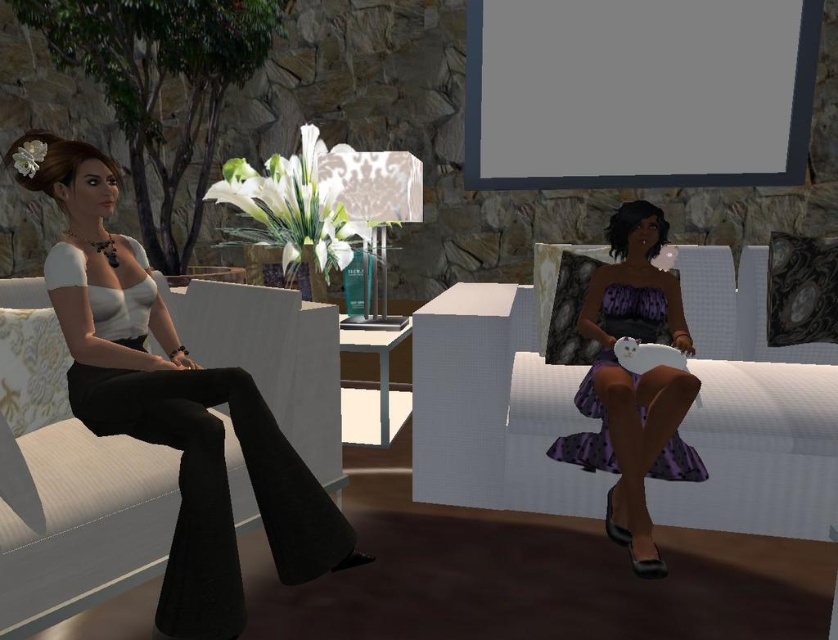
Is white textured couch at right to the left of matte black pants at left from the viewer's perspective?

Incorrect, white textured couch at right is not on the left side of matte black pants at left.

Image resolution: width=838 pixels, height=640 pixels. What do you see at coordinates (749, 410) in the screenshot?
I see `white textured couch at right` at bounding box center [749, 410].

Between point (492, 480) and point (262, 460), which one is positioned behind?

The point (492, 480) is behind.

Find the location of a particular element. This screenshot has width=838, height=640. white textured couch at right is located at coordinates (749, 410).

Between white textured couch at right and purple satin dress at right, which one is positioned higher?

white textured couch at right is higher up.

Between white textured couch at right and purple satin dress at right, which one has less height?

With less height is purple satin dress at right.

The image size is (838, 640). What do you see at coordinates (749, 410) in the screenshot?
I see `white textured couch at right` at bounding box center [749, 410].

In order to click on white textured couch at right in this screenshot , I will do `click(749, 410)`.

Does matte black pants at left appear under purple satin dress at right?

Actually, matte black pants at left is above purple satin dress at right.

Between matte black pants at left and purple satin dress at right, which one is positioned higher?

matte black pants at left is higher up.

The height and width of the screenshot is (640, 838). Describe the element at coordinates (172, 403) in the screenshot. I see `matte black pants at left` at that location.

Where is `matte black pants at left`? Image resolution: width=838 pixels, height=640 pixels. matte black pants at left is located at coordinates (172, 403).